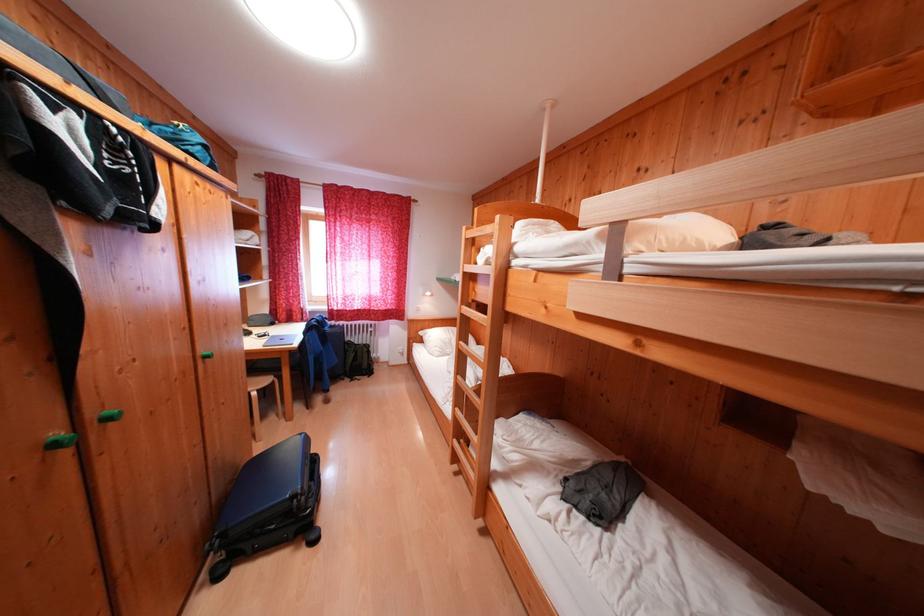
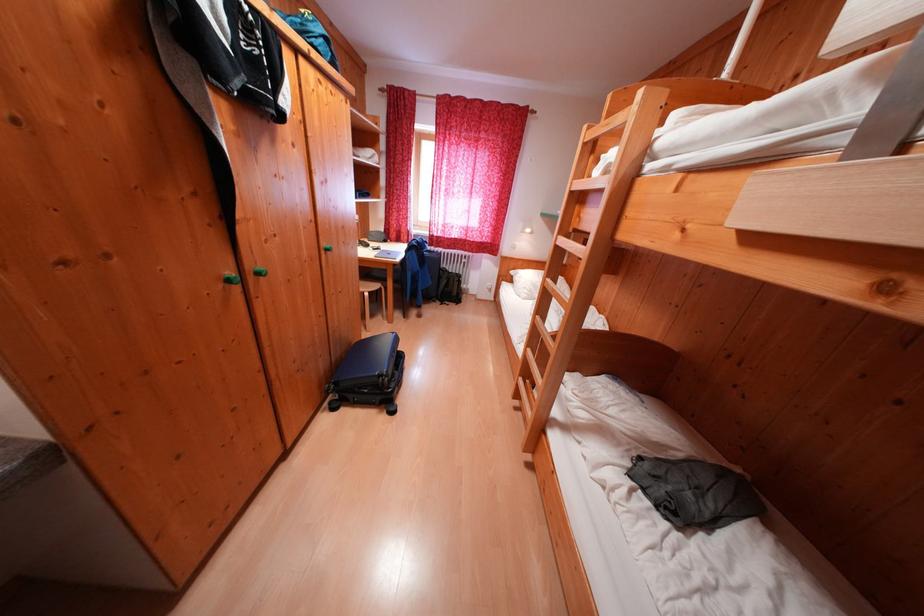
In the second image, find the point that corresponds to pixel 102 418 in the first image.

(258, 272)